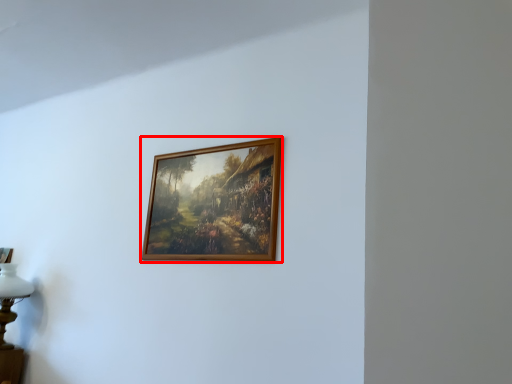
Question: Where is picture frame (annotated by the red box) located in relation to table lamp in the image?

Choices:
 (A) left
 (B) right

Answer: (B)